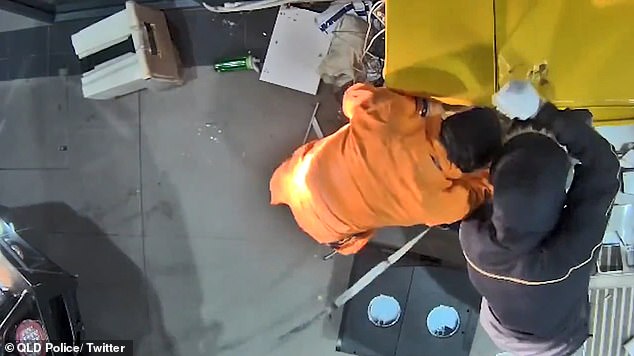
Where is `stool`? stool is located at coordinates (132, 69).